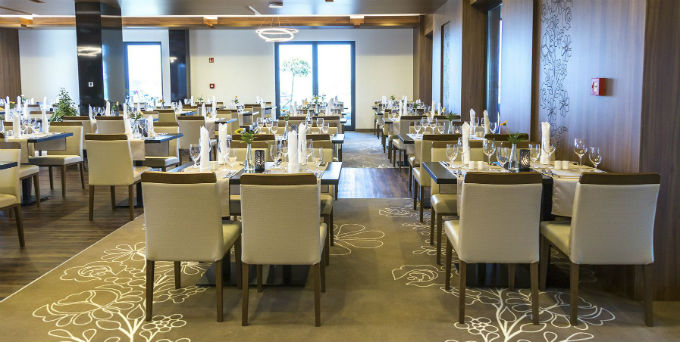
The width and height of the screenshot is (680, 342). Identify the location of 9 tables in a restaurant. (44, 141), (222, 173), (447, 168), (409, 140), (160, 140), (277, 132), (226, 103), (181, 105), (32, 106).